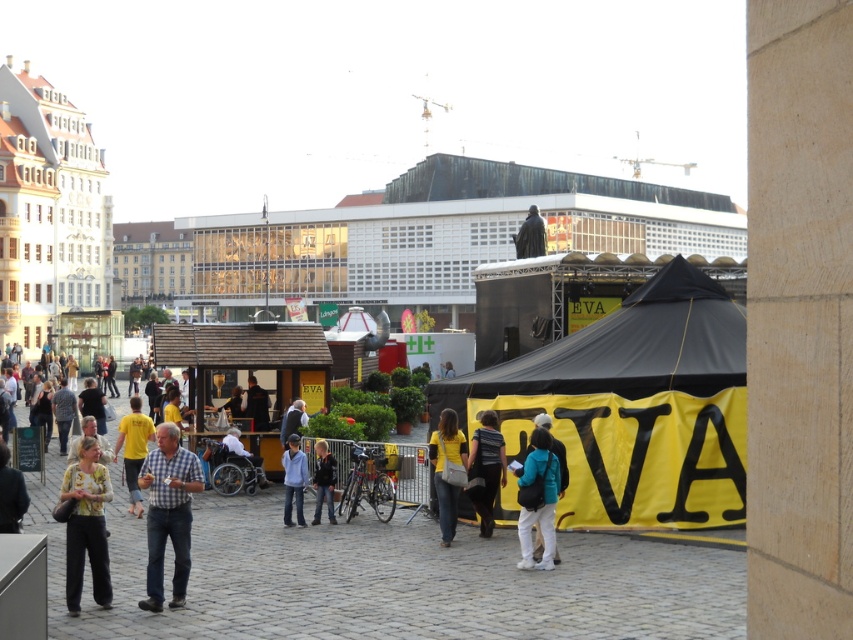
Is point (438, 419) positioned in front of point (12, 506)?

No.

Which is above, yellow fabric shirt at center or yellow shirt at lower left?

yellow fabric shirt at center is higher up.

In the scene shown: Who is more distant from viewer, (444, 426) or (12, 474)?

Positioned behind is point (444, 426).

The width and height of the screenshot is (853, 640). I want to click on yellow fabric shirt at center, so click(x=442, y=467).

Is black/yellow fabric tent at center shorter than teal fabric backpack at center?

Incorrect, black/yellow fabric tent at center's height does not fall short of teal fabric backpack at center's.

Can you confirm if black/yellow fabric tent at center is bigger than teal fabric backpack at center?

Correct, black/yellow fabric tent at center is larger in size than teal fabric backpack at center.

Is point (521, 378) positioned before point (546, 554)?

No, (521, 378) is further to viewer.

Locate an element on the screen. black/yellow fabric tent at center is located at coordinates (635, 404).

In the scene shown: Does yellow fabric shirt at center appear on the left side of yellow t-shirt at center?

No, yellow fabric shirt at center is not to the left of yellow t-shirt at center.

Who is more distant from viewer, (444,413) or (135,502)?

Positioned behind is point (135,502).

You are a GUI agent. You are given a task and a screenshot of the screen. Output one action in this format:
    pyautogui.click(x=<x>, y=<y>)
    Task: Click on the yellow fabric shirt at center
    This screenshot has width=853, height=640.
    Given the screenshot: What is the action you would take?
    pyautogui.click(x=442, y=467)